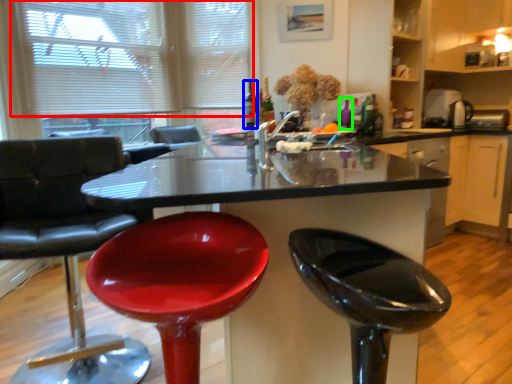
Question: Which is farther away from blind (highlighted by a red box)? bottle (highlighted by a blue box) or bottle (highlighted by a green box)?

Choices:
 (A) bottle
 (B) bottle

Answer: (B)